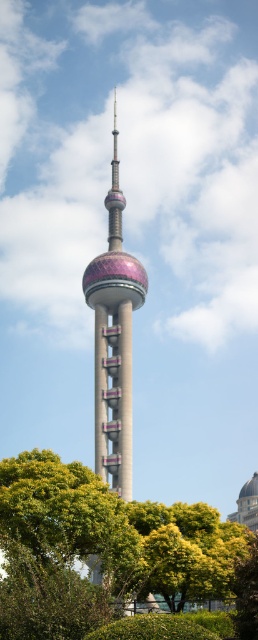
Question: Which object is closer to the camera taking this photo?

Choices:
 (A) green leafy tree at center
 (B) metallic silver tower at center
 (C) green leafy tree at lower center

Answer: (A)

Question: Can you confirm if green leafy tree at center is positioned to the left of metallic silver tower at center?

Choices:
 (A) yes
 (B) no

Answer: (B)

Question: Estimate the real-world distances between objects in this image. Which object is farther from the green leafy tree at center?

Choices:
 (A) green leafy tree at lower center
 (B) metallic silver tower at center

Answer: (B)

Question: Does green leafy tree at center have a lesser width compared to metallic silver tower at center?

Choices:
 (A) no
 (B) yes

Answer: (A)

Question: Can you confirm if green leafy tree at center is wider than green leafy tree at lower center?

Choices:
 (A) no
 (B) yes

Answer: (B)

Question: Which point is closer to the camera taking this photo?

Choices:
 (A) (235, 547)
 (B) (46, 506)

Answer: (B)